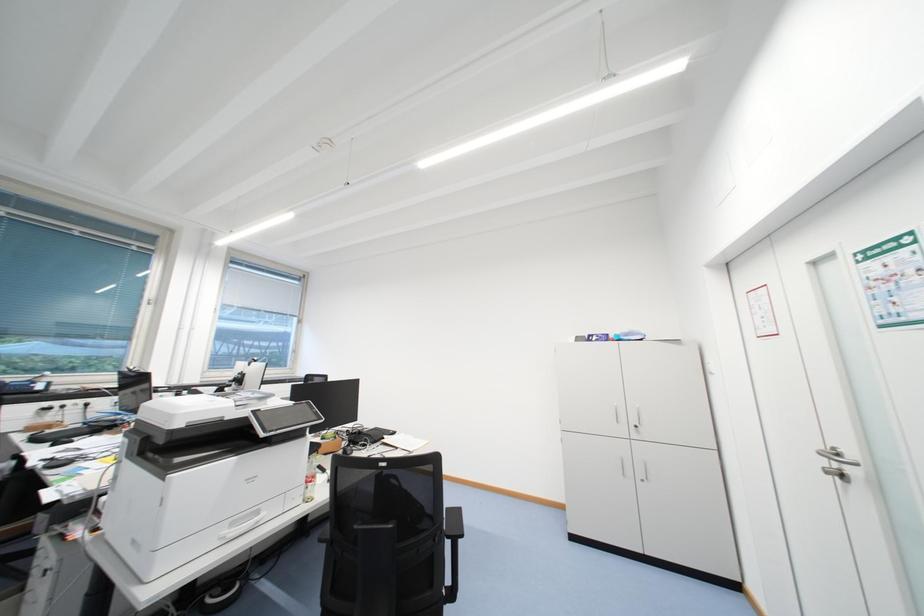
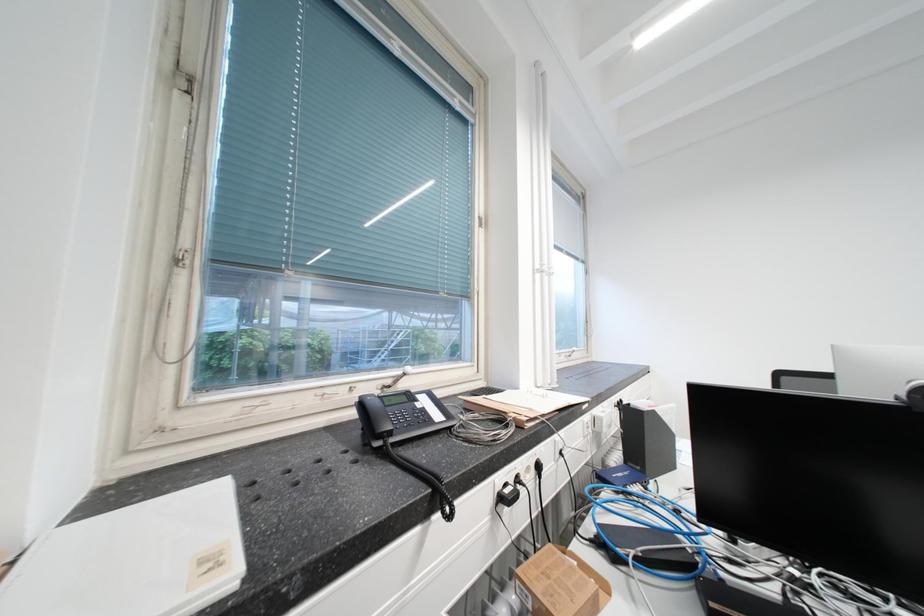
What movement of the cameraman would produce the second image?

The cameraman walked toward left, forward.